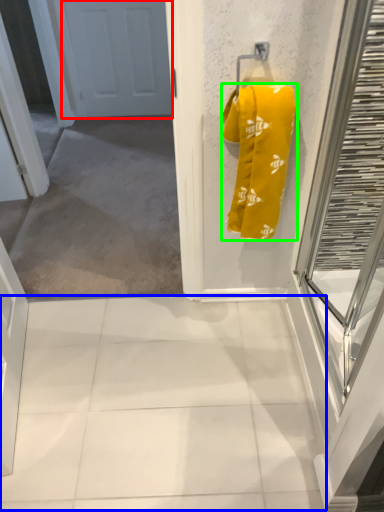
Question: Estimate the real-world distances between objects in this image. Which object is farther from door (highlighted by a red box), tile (highlighted by a blue box) or towel (highlighted by a green box)?

Choices:
 (A) tile
 (B) towel

Answer: (A)